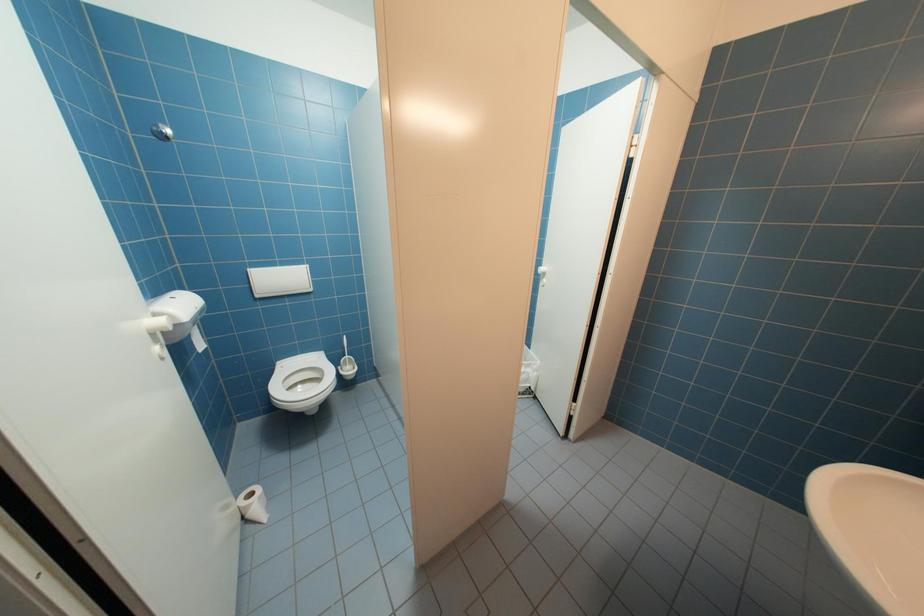
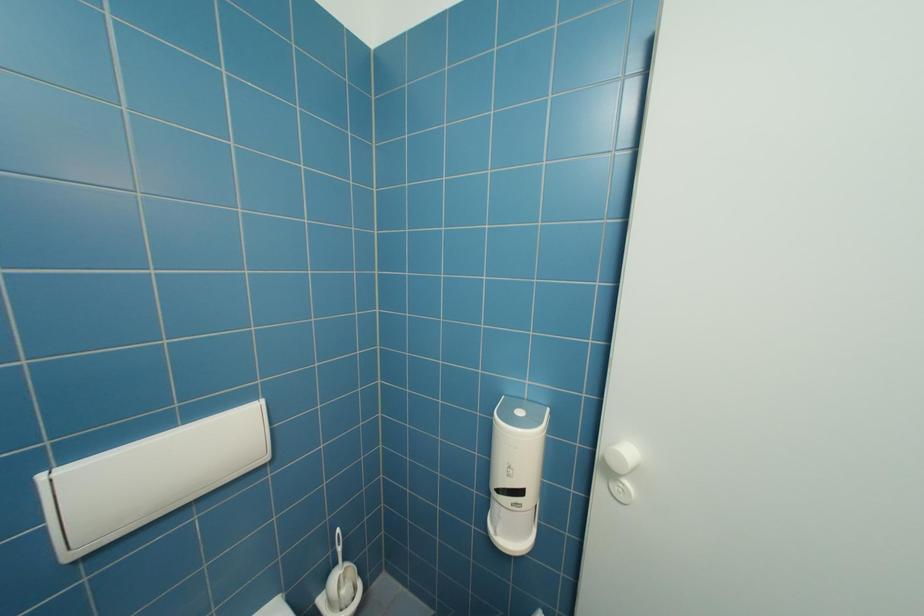
Question: What movement of the cameraman would produce the second image?

Choices:
 (A) Left
 (B) Right
 (C) Forward
 (D) Backward

Answer: (C)